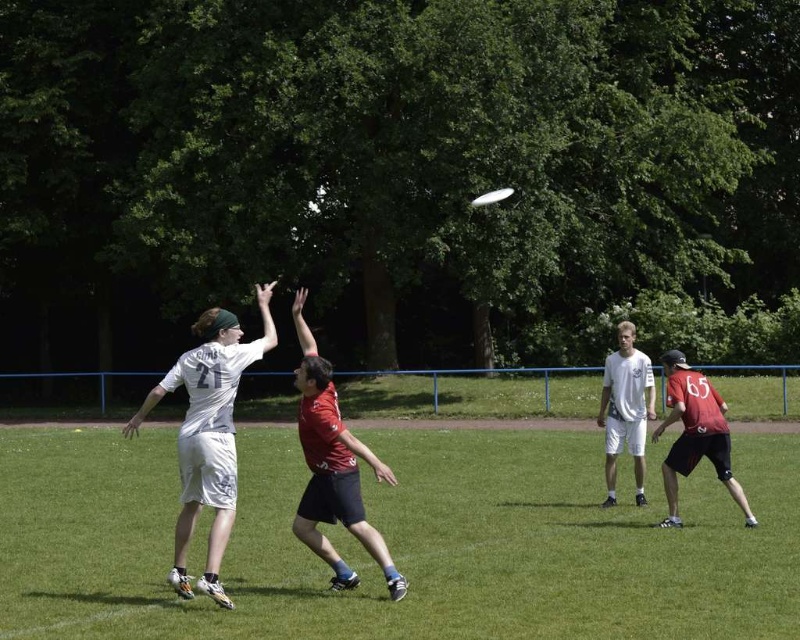
Question: Which is farther from the red matte jersey at center?

Choices:
 (A) white matte shorts at center
 (B) matte red jersey at center
 (C) white plastic frisbee at upper center

Answer: (C)

Question: Which of the following is the farthest from the observer?

Choices:
 (A) red matte jersey at center
 (B) matte red jersey at center
 (C) white matte shorts at center
 (D) green grass at center

Answer: (C)

Question: Is green grass at center wider than red matte jersey at center?

Choices:
 (A) yes
 (B) no

Answer: (A)

Question: Which object is positioned closest to the green grass at center?

Choices:
 (A) white matte jersey at center
 (B) red matte jersey at center

Answer: (A)

Question: Can you confirm if matte red jersey at center is wider than white plastic frisbee at upper center?

Choices:
 (A) no
 (B) yes

Answer: (B)

Question: Can you confirm if matte red jersey at center is thinner than red matte jersey at center?

Choices:
 (A) no
 (B) yes

Answer: (A)